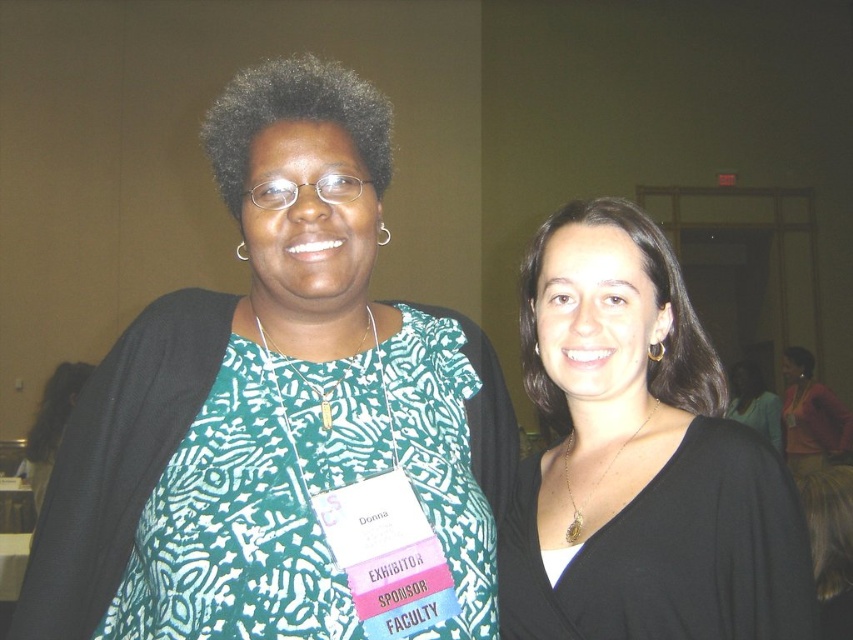
Question: Can you confirm if green printed blouse at center is thinner than black matte necklace at center?

Choices:
 (A) no
 (B) yes

Answer: (A)

Question: Which point is closer to the camera?

Choices:
 (A) black matte necklace at center
 (B) green printed blouse at center

Answer: (B)

Question: Is green printed blouse at center below black matte necklace at center?

Choices:
 (A) no
 (B) yes

Answer: (A)

Question: Is green printed blouse at center positioned in front of black matte necklace at center?

Choices:
 (A) yes
 (B) no

Answer: (A)

Question: Which point is farther to the camera?

Choices:
 (A) green printed blouse at center
 (B) black matte necklace at center

Answer: (B)